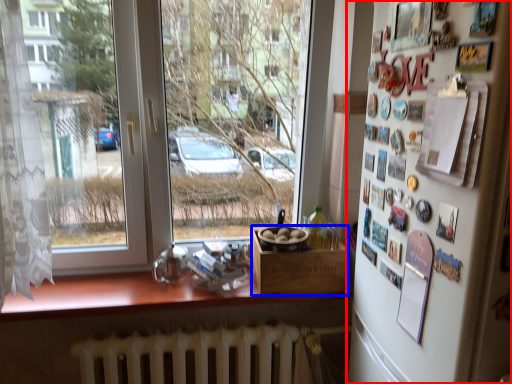
Question: Which object appears closest to the camera in this image, mirror (highlighted by a red box) or box (highlighted by a blue box)?

Choices:
 (A) mirror
 (B) box

Answer: (A)